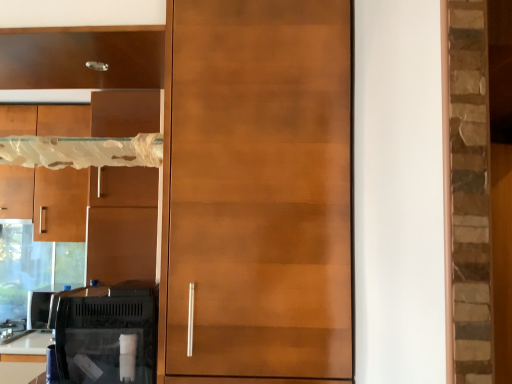
Question: Relative to matte brown cabinet at left, which is the second cabinetry from front to back, is glossy wood door at center in front or behind?

Choices:
 (A) front
 (B) behind

Answer: (A)

Question: From the image's perspective, is glossy wood door at center positioned above or below matte brown cabinet at left, the 1th cabinetry positioned from the back?

Choices:
 (A) below
 (B) above

Answer: (B)

Question: Considering the real-world distances, which object is closest to the glossy wood door at center?

Choices:
 (A) matte wood cabinet at upper left, positioned as the 1th cabinetry in front-to-back order
 (B) matte brown cabinet at left, which is counted as the first cabinetry, starting from the bottom

Answer: (A)

Question: Estimate the real-world distances between objects in this image. Which object is closer to the matte wood cabinet at upper left, the 1th cabinetry positioned from the right?

Choices:
 (A) matte brown cabinet at left, which is counted as the first cabinetry, starting from the bottom
 (B) glossy wood door at center

Answer: (B)